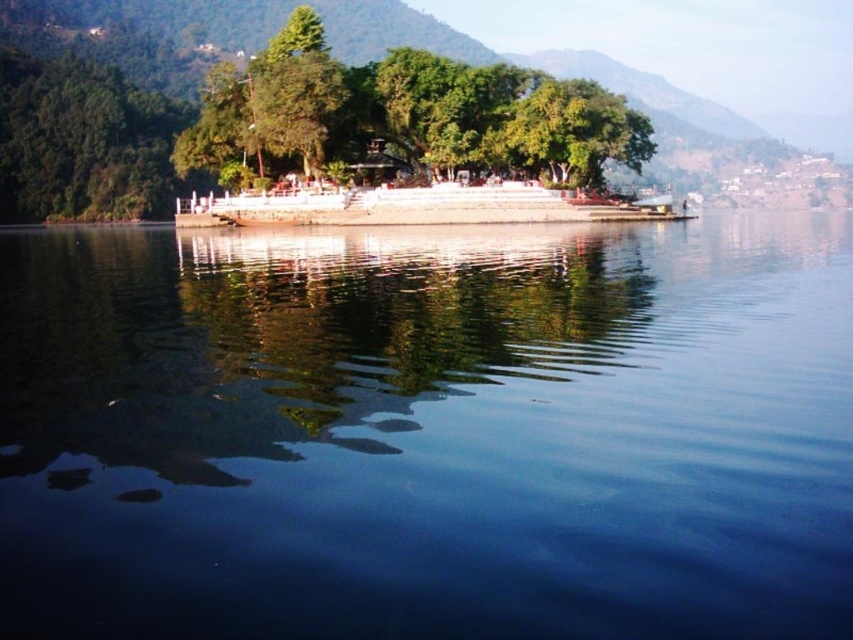
Question: Can you confirm if transparent blue water at center is wider than green leafy tree at center?

Choices:
 (A) no
 (B) yes

Answer: (A)

Question: Observing the image, what is the correct spatial positioning of transparent blue water at center in reference to green leafy tree at center?

Choices:
 (A) right
 (B) left

Answer: (A)

Question: Is transparent blue water at center above green leafy tree at center?

Choices:
 (A) no
 (B) yes

Answer: (A)

Question: Which object appears farthest from the camera in this image?

Choices:
 (A) green leafy tree at center
 (B) transparent blue water at center

Answer: (A)

Question: Which of the following is the farthest from the observer?

Choices:
 (A) green leafy tree at center
 (B) transparent blue water at center

Answer: (A)

Question: Which point is closer to the camera taking this photo?

Choices:
 (A) (21, 586)
 (B) (544, 170)

Answer: (A)